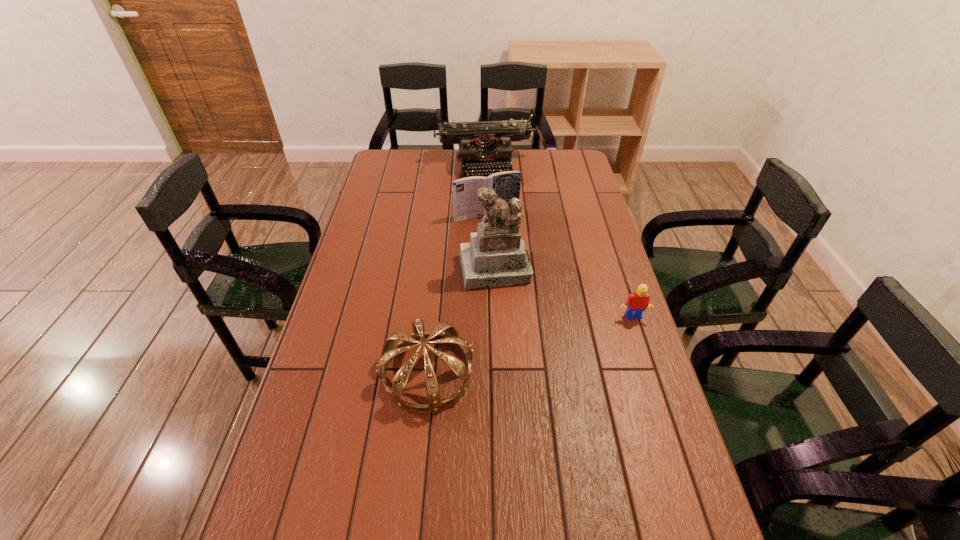
Image resolution: width=960 pixels, height=540 pixels. In order to click on tiara in this screenshot , I will do `click(391, 348)`.

The image size is (960, 540). I want to click on Lego, so click(x=636, y=303).

At what (x,y) coordinates should I click in order to perform the action: click on the fourth farthest object. Please return your answer as a coordinate pair (x, y). Looking at the image, I should click on (636, 303).

Find the location of a particular element. The image size is (960, 540). the second farthest object is located at coordinates (466, 204).

Locate an element on the screen. Image resolution: width=960 pixels, height=540 pixels. the tallest object is located at coordinates (496, 256).

At what (x,y) coordinates should I click in order to perform the action: click on figurine. Please return your answer as a coordinate pair (x, y). This screenshot has width=960, height=540. Looking at the image, I should click on (496, 256).

Locate an element on the screen. This screenshot has height=540, width=960. the farthest object is located at coordinates (484, 146).

At what (x,y) coordinates should I click in order to perform the action: click on vacant region located 0.070m on the right of the tiara. Please return your answer as a coordinate pair (x, y). Image resolution: width=960 pixels, height=540 pixels. Looking at the image, I should click on (500, 373).

Where is `vacant area located on the front-facing side of the Lego`? The height and width of the screenshot is (540, 960). vacant area located on the front-facing side of the Lego is located at coordinates (645, 360).

Locate an element on the screen. Image resolution: width=960 pixels, height=540 pixels. free space located on the front cover of the second farthest object is located at coordinates (509, 247).